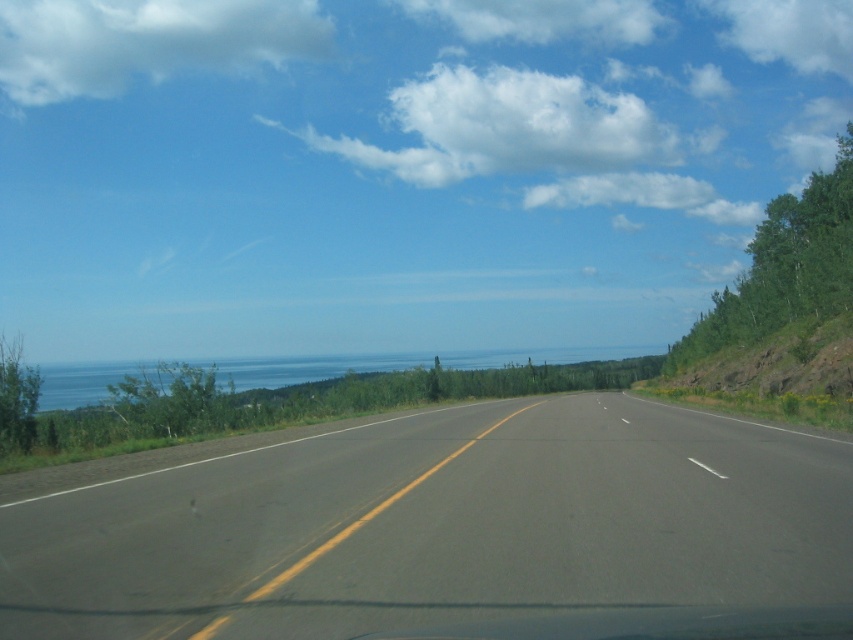
You are a driver planning to take a photo of the blue water at center and the asphalt road at center from your car window. Which object will appear larger in the photo?

The blue water at center will appear larger in the photo because it occupies more space than the asphalt road at center.

Looking at this image, you are a photographer positioned at the camera location. You want to take a photo that includes both point (160,588) and point (280,360). Which point will appear larger in the photo?

Point (160,588) is closer to the camera than point (280,360), so it will appear larger in the photo.